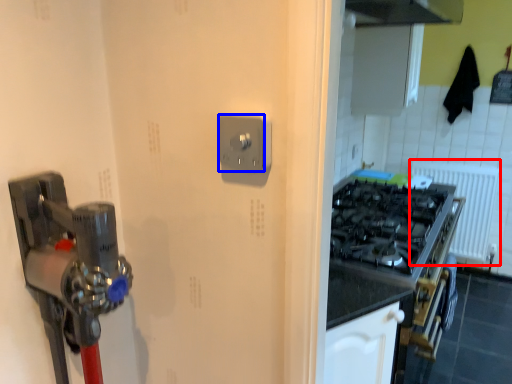
Question: Which object appears closest to the camera in this image, radiator (highlighted by a red box) or light switch (highlighted by a blue box)?

Choices:
 (A) radiator
 (B) light switch

Answer: (B)